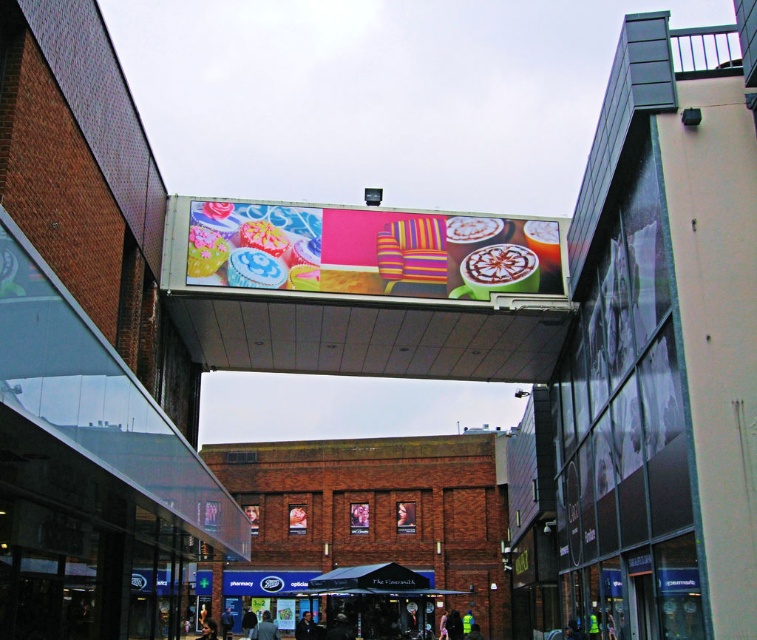
Is point (396, 580) closer to viewer compared to point (273, 628)?

No, (396, 580) is further to viewer.

Between black fabric canopy at center and light blue denim jacket at center, which one is positioned higher?

Positioned higher is black fabric canopy at center.

Is point (382, 582) positioned behind point (263, 625)?

That is True.

Find the location of a particular element. The height and width of the screenshot is (640, 757). black fabric canopy at center is located at coordinates (369, 579).

Does dark blue jacket at center come in front of dark brown hair at center?

Yes, it is.

Does dark blue jacket at center have a greater width compared to dark brown hair at center?

No, dark blue jacket at center is not wider than dark brown hair at center.

Who is more forward, (315, 625) or (210, 628)?

Point (315, 625) is in front.

This screenshot has width=757, height=640. Identify the location of dark blue jacket at center. (307, 627).

Can you confirm if black fabric canopy at center is positioned to the left of dark brown hair at center?

No, black fabric canopy at center is not to the left of dark brown hair at center.

Is black fabric canopy at center wider than dark brown hair at center?

Indeed, black fabric canopy at center has a greater width compared to dark brown hair at center.

The width and height of the screenshot is (757, 640). In order to click on black fabric canopy at center in this screenshot , I will do `click(369, 579)`.